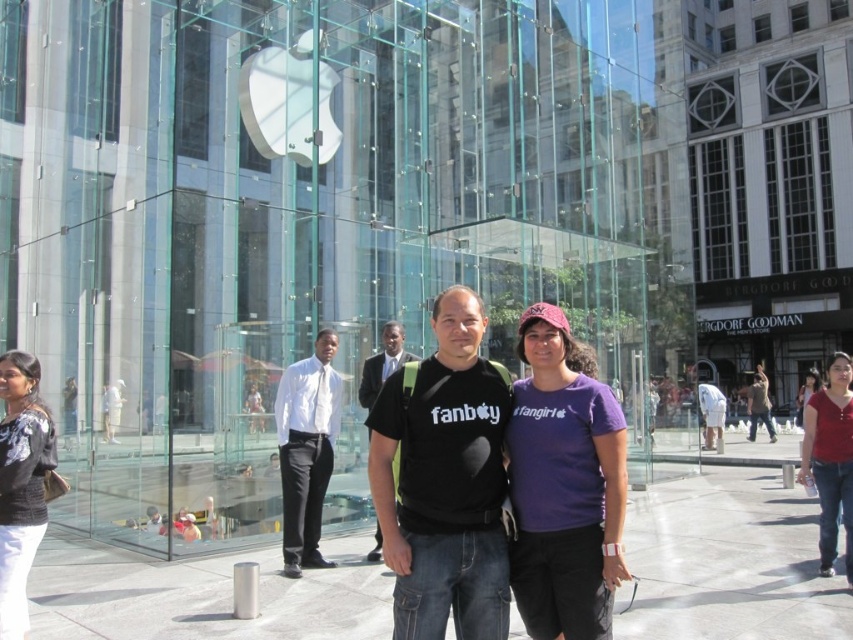
You are standing in the bustling urban scene in front of the glass walled building with the Apple logo. You see a point marked at coordinates (728, 563). What is located at that point?

Concrete at center is located at point (728, 563).

Consider the image. You are a photographer trying to capture a photo of the white glossy shirt at center and the red cotton shirt at lower right. Based on their sizes, which one would appear smaller in the photo?

The white glossy shirt at center has a lesser width compared to the red cotton shirt at lower right, so it would appear smaller in the photo.

You are standing in front of the glass building with the Apple logo. You want to place a small potted plant on the ground. Where should you place it so that it is exactly at the center of the concrete at center? Please provide the coordinates in the format of point coordinates. The coordinate system is based on the image, with the origin at the bottom left corner of the image. The x and y axes are normalized between 0 and 1.

The coordinates for the center of the concrete at center are point coordinates at point coordinates at point coordinates at point coordinates at point coordinates at point coordinates at point coordinates at point coordinates at point coordinates at point coordinates at point coordinates at point coordinates at point coordinates at point coordinates at point coordinates at point coordinates at point coordinates at point coordinates at point coordinates at point coordinates at point coordinates at point